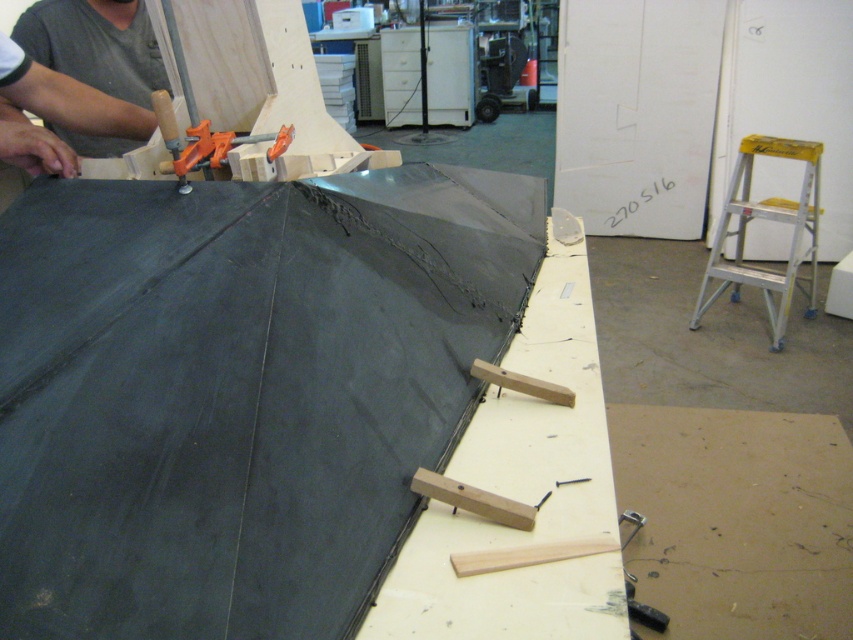
You are an assistant in the workshop and need to choose between the gray fabric at upper left and the yellow aluminum stool at right to lift a heavy object. Which one is more suitable for the task?

The yellow aluminum stool at right is more suitable because it is thicker than the gray fabric at upper left, making it stronger and more stable for lifting heavy objects.

You are organizing a workshop and need to place the gray fabric at upper left and the yellow aluminum stool at right on a shelf. Which object should you place first if you want to arrange them from smallest to largest?

The gray fabric at upper left should be placed first since it is smaller than the yellow aluminum stool at right.

You are organizing tools in the workshop and need to place a new tool between the brown matte plywood at lower right and the yellow aluminum stool at right. Based on their positions, which object should you place the tool closer to if you want it to be on the left side of the stool?

The brown matte plywood at lower right is already to the left of the yellow aluminum stool at right. Therefore, placing the tool closer to the brown matte plywood at lower right will position it on the left side of the stool.